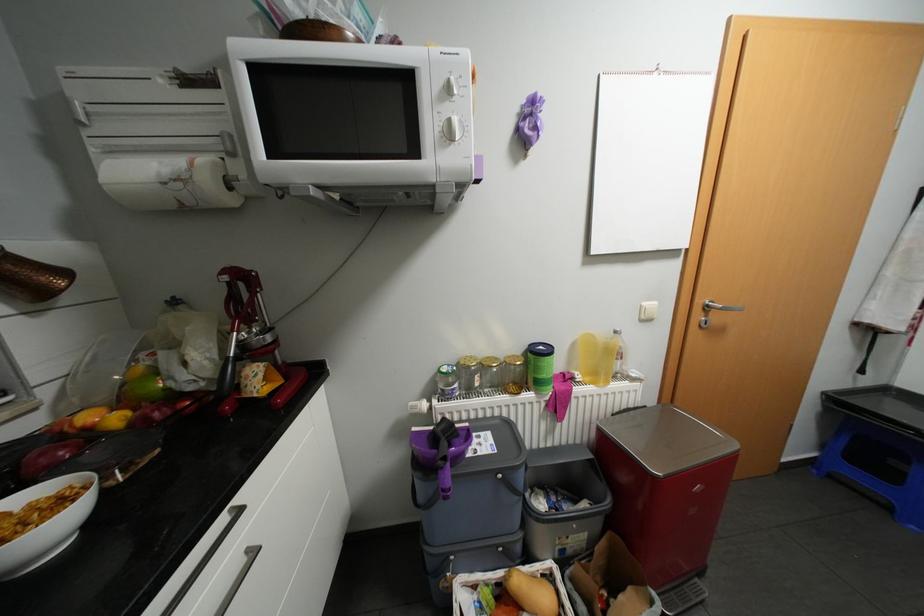
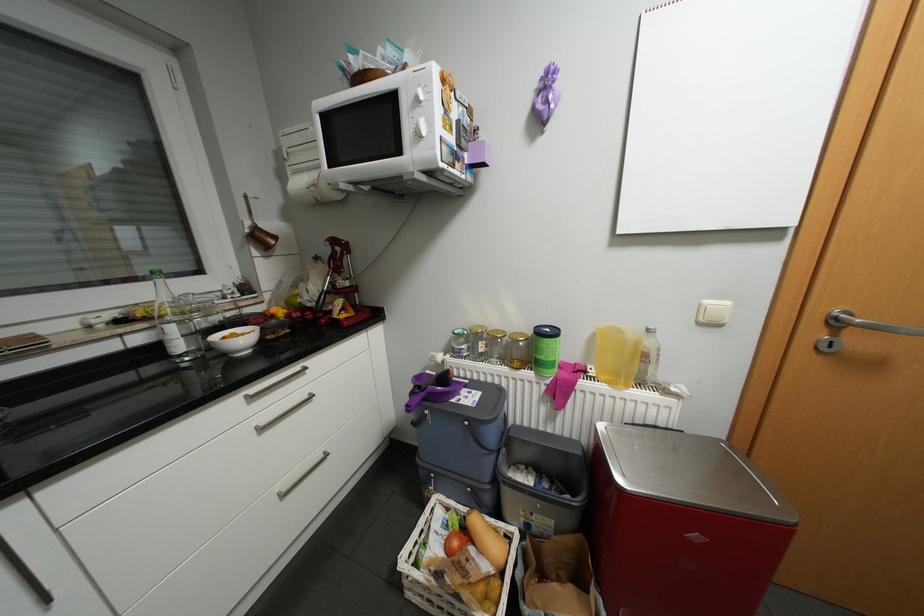
Find the pixel in the second image that matches [444,448] in the first image.

(441, 389)